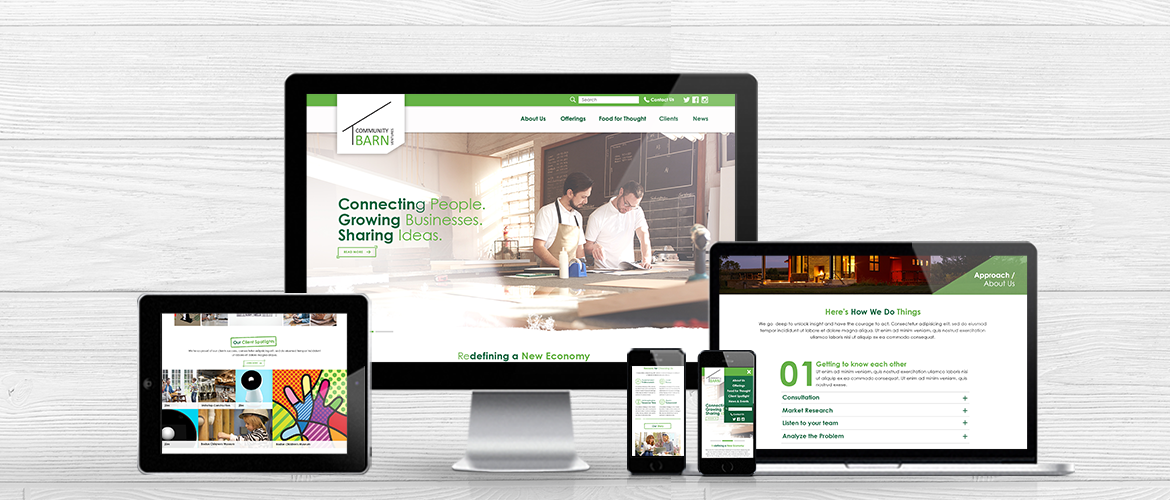
This screenshot has width=1170, height=500. What are the coordinates of `monitor stand` in the screenshot? It's located at (523, 420).